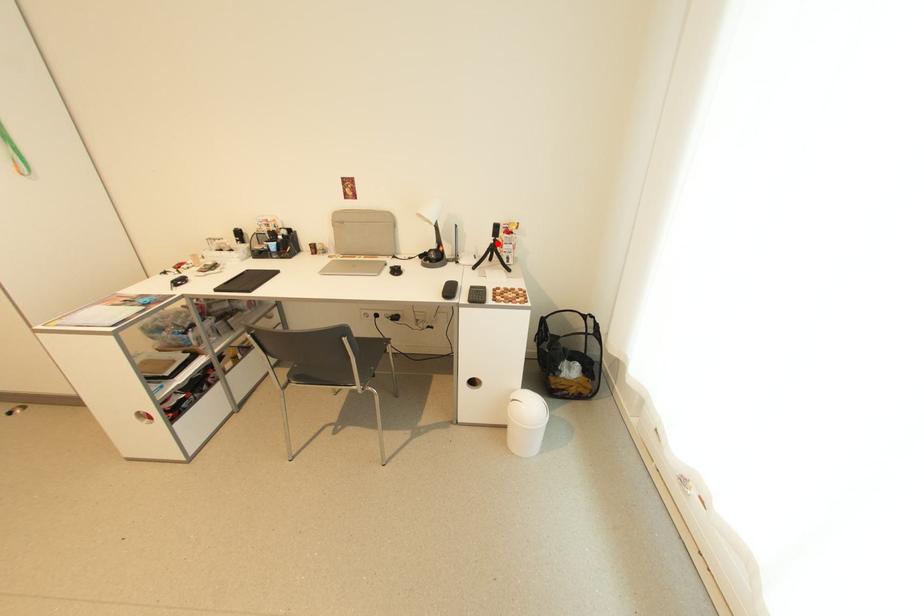
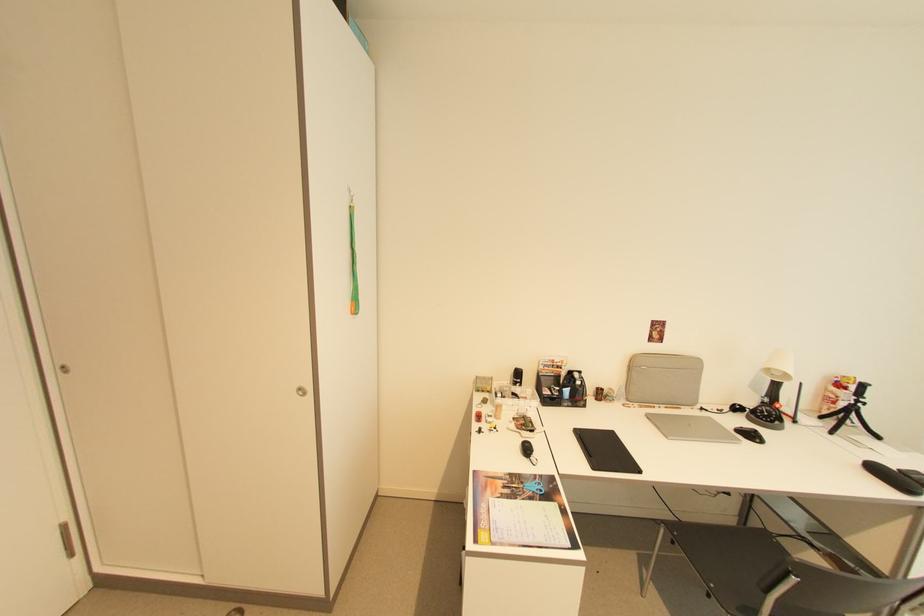
Question: A red point is marked in image1. In image2, is the corresponding 3D point closer to the camera or farther? Reply with the corresponding letter.

Choices:
 (A) The corresponding 3D point is closer.
 (B) The corresponding 3D point is farther.

Answer: (A)